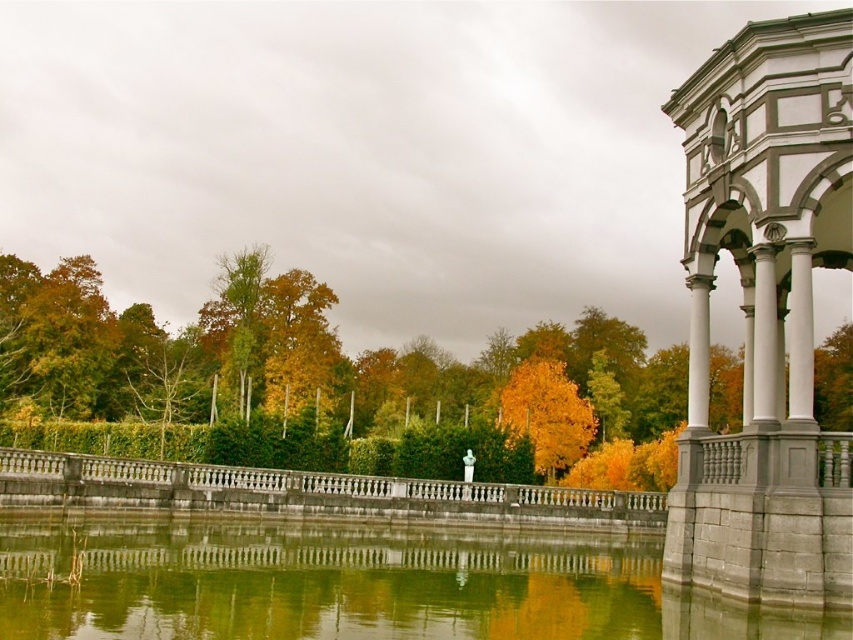
Is yellow-green leaves at center thinner than green reflective water at center?

In fact, yellow-green leaves at center might be wider than green reflective water at center.

Is yellow-green leaves at center bigger than green reflective water at center?

Yes, yellow-green leaves at center is bigger than green reflective water at center.

Is point (410, 449) behind point (635, 582)?

That is True.

I want to click on yellow-green leaves at center, so click(x=291, y=380).

Does yellow-green leaves at center appear under yellow leafy tree at center?

Incorrect, yellow-green leaves at center is not positioned below yellow leafy tree at center.

Is point (432, 422) positioned before point (578, 445)?

That is False.

Which is behind, point (338, 426) or point (550, 432)?

The point (550, 432) is behind.

You are a GUI agent. You are given a task and a screenshot of the screen. Output one action in this format:
    pyautogui.click(x=<x>, y=<y>)
    Task: Click on the yellow-green leaves at center
    
    Given the screenshot: What is the action you would take?
    pyautogui.click(x=291, y=380)

Does yellow-green leaves at center have a lesser width compared to gray stone gazebo at right?

Incorrect, yellow-green leaves at center's width is not less than gray stone gazebo at right's.

Describe the element at coordinates (291, 380) in the screenshot. I see `yellow-green leaves at center` at that location.

Identify the location of yellow-green leaves at center. The width and height of the screenshot is (853, 640). (291, 380).